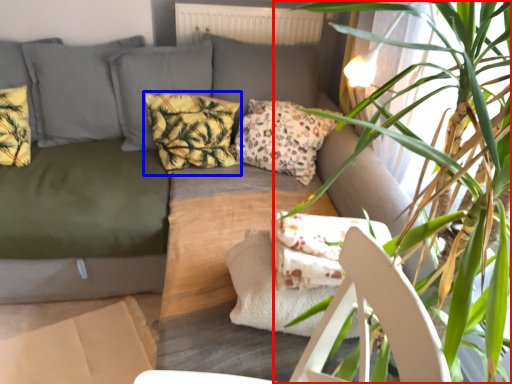
Question: Which of the following is the closest to the observer, houseplant (highlighted by a red box) or pillow (highlighted by a blue box)?

Choices:
 (A) houseplant
 (B) pillow

Answer: (A)